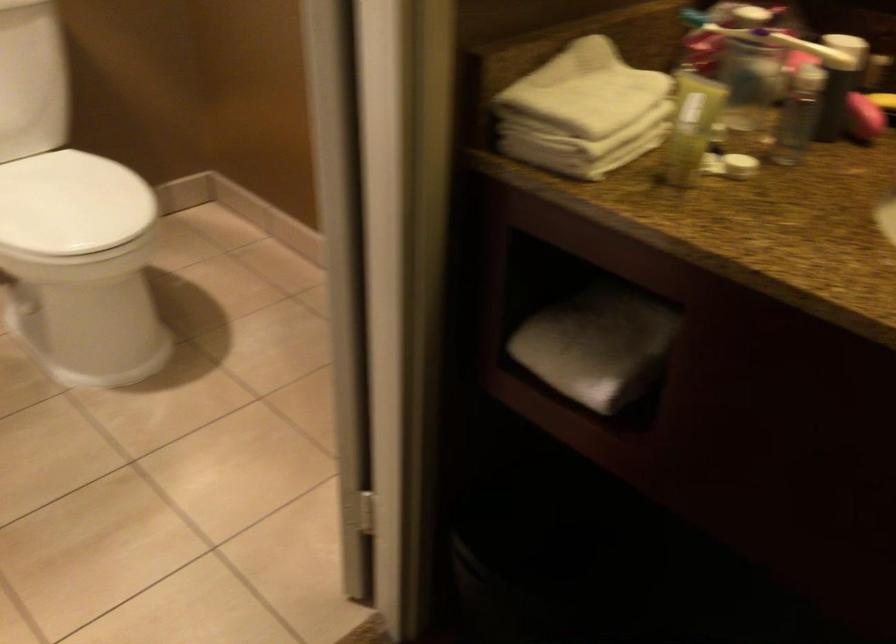
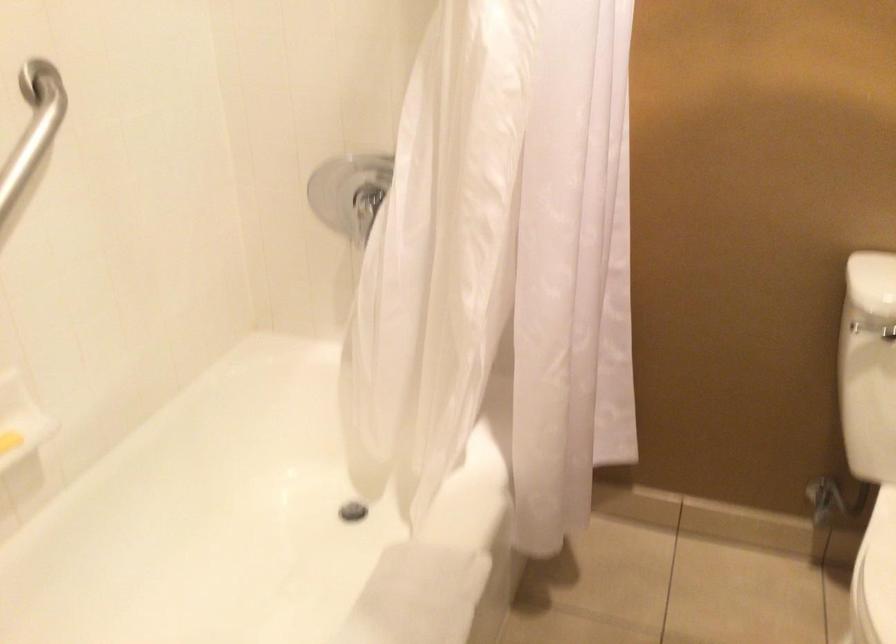
Question: The camera is either moving clockwise (left) or counter-clockwise (right) around the object. The first image is from the beginning of the video and the second image is from the end. Is the camera moving left or right when shooting the video?

Choices:
 (A) Left
 (B) Right

Answer: (B)